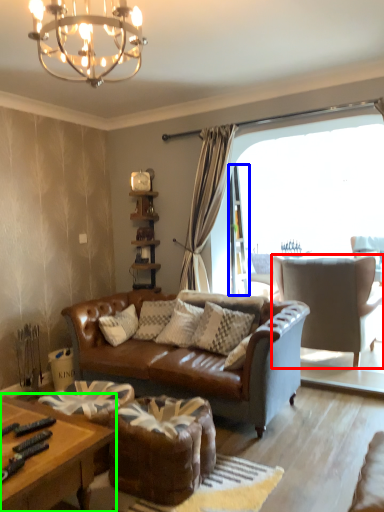
Question: Considering the real-world distances, which object is closest to chair (highlighted by a red box)? screen door (highlighted by a blue box) or coffee table (highlighted by a green box).

Choices:
 (A) screen door
 (B) coffee table

Answer: (A)